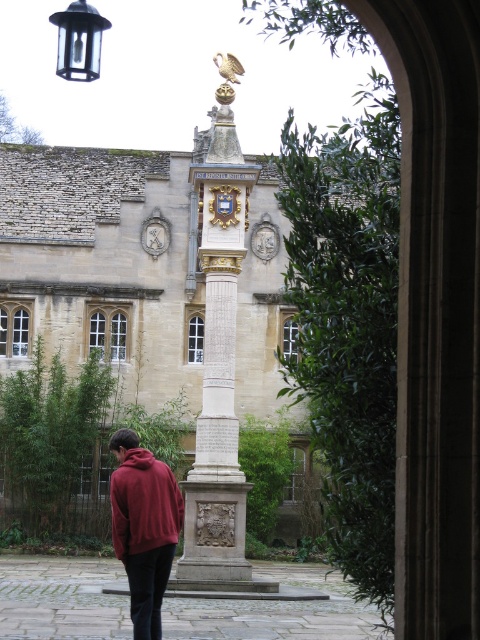
Does gold polished stone column at center appear on the left side of maroon fleece jacket at lower left?

Incorrect, gold polished stone column at center is not on the left side of maroon fleece jacket at lower left.

Between gold polished stone column at center and maroon fleece jacket at lower left, which one is positioned lower?

maroon fleece jacket at lower left is lower down.

Which is behind, point (222, 445) or point (135, 497)?

The point (222, 445) is behind.

At what (x,y) coordinates should I click in order to perform the action: click on gold polished stone column at center. Please return your answer as a coordinate pair (x, y). This screenshot has width=480, height=640. Looking at the image, I should click on (218, 365).